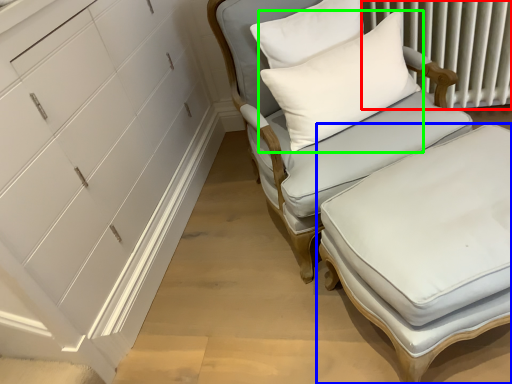
Question: Which object is positioned closest to radiator (highlighted by a red box)? Select from table (highlighted by a blue box) and pillow (highlighted by a green box).

Choices:
 (A) table
 (B) pillow

Answer: (B)